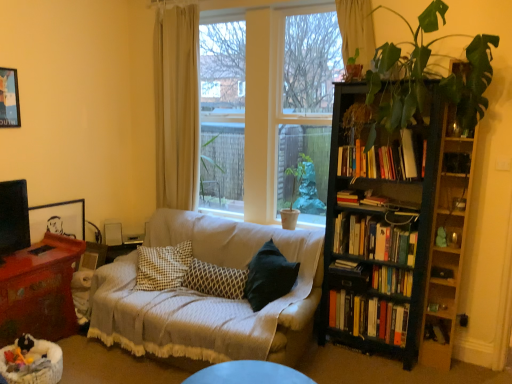
Find the location of a particular element. hardcover book at center-right, which is the 4th book from top to bottom is located at coordinates (x=346, y=267).

Describe the element at coordinates (346, 267) in the screenshot. I see `hardcover book at center-right, the third book ordered from the bottom` at that location.

In the scene shown: What is the approximate width of hardcover books at center-right, placed as the 6th book when sorted from bottom to top?

hardcover books at center-right, placed as the 6th book when sorted from bottom to top, is 10.52 inches in width.

What do you see at coordinates (384, 159) in the screenshot? This screenshot has width=512, height=384. I see `hardcover books at center-right, placed as the 6th book when sorted from bottom to top` at bounding box center [384, 159].

Where is `green leafy plant at upper right`? green leafy plant at upper right is located at coordinates (421, 71).

This screenshot has height=384, width=512. What are the coordinates of `black wooden bookcase at right` in the screenshot? It's located at (397, 240).

The image size is (512, 384). What do you see at coordinates (93, 256) in the screenshot?
I see `wooden picture frame at left, acting as the 1th picture frame starting from the back` at bounding box center [93, 256].

The width and height of the screenshot is (512, 384). Identify the location of hardcover books at right, which is the sixth book from top to bottom. (368, 317).

This screenshot has height=384, width=512. I want to click on hardcover book at center-right, the third book ordered from the bottom, so coord(346,267).

Considering the relative sizes of wooden picture frame at left, which appears as the second picture frame when viewed from the front, and patterned fabric pillow at center in the image provided, is wooden picture frame at left, which appears as the second picture frame when viewed from the front, thinner than patterned fabric pillow at center?

Yes, wooden picture frame at left, which appears as the second picture frame when viewed from the front, is thinner than patterned fabric pillow at center.

Relative to patterned fabric pillow at center, is wooden picture frame at left, arranged as the second picture frame when viewed from the top, in front or behind?

Visually, wooden picture frame at left, arranged as the second picture frame when viewed from the top, is located behind patterned fabric pillow at center.

From the image's perspective, which picture frame is the 1st one above the patterned fabric pillow at center? Please provide its 2D coordinates.

[(93, 256)]

Does wooden picture frame at left, which appears as the second picture frame when viewed from the front, appear on the right side of patterned fabric pillow at center?

Incorrect, wooden picture frame at left, which appears as the second picture frame when viewed from the front, is not on the right side of patterned fabric pillow at center.

Based on the photo, does mahogany wood table at lower left touch hardcover book at center-right, which is the 4th book from top to bottom?

They are not placed beside each other.

Based on the photo, which is correct: mahogany wood table at lower left is inside hardcover book at center-right, which is the 4th book from top to bottom, or outside of it?

mahogany wood table at lower left is not inside hardcover book at center-right, which is the 4th book from top to bottom, it's outside.

In the scene shown: From the image's perspective, who appears lower, mahogany wood table at lower left or hardcover book at center-right, the third book ordered from the bottom?

mahogany wood table at lower left appears lower in the image.

Between mahogany wood table at lower left and hardcover book at center-right, the third book ordered from the bottom, which one has larger width?

With larger width is mahogany wood table at lower left.

Considering the sizes of objects beige fabric curtain at upper center, which is counted as the first curtain, starting from the front, and mahogany wood table at lower left in the image provided, who is bigger, beige fabric curtain at upper center, which is counted as the first curtain, starting from the front, or mahogany wood table at lower left?

With larger size is mahogany wood table at lower left.

From the image's perspective, relative to mahogany wood table at lower left, is beige fabric curtain at upper center, the second curtain in the back-to-front sequence, above or below?

Clearly, from the image's perspective, beige fabric curtain at upper center, the second curtain in the back-to-front sequence, is above mahogany wood table at lower left.

Is beige fabric curtain at upper center, which is counted as the first curtain, starting from the front, turned away from mahogany wood table at lower left?

No, mahogany wood table at lower left is not at the back of beige fabric curtain at upper center, which is counted as the first curtain, starting from the front.

Locate an element on the screen. The height and width of the screenshot is (384, 512). picture frame that is the 2nd one above the mahogany wood table at lower left (from a real-world perspective) is located at coordinates point(9,98).

Is brushed metal picture frame at upper left, positioned as the second picture frame in right-to-left order, oriented towards mahogany wood table at lower left?

No, brushed metal picture frame at upper left, positioned as the second picture frame in right-to-left order, is not aimed at mahogany wood table at lower left.

Considering the sizes of objects brushed metal picture frame at upper left, positioned as the second picture frame in right-to-left order, and mahogany wood table at lower left in the image provided, who is shorter, brushed metal picture frame at upper left, positioned as the second picture frame in right-to-left order, or mahogany wood table at lower left?

Standing shorter between the two is brushed metal picture frame at upper left, positioned as the second picture frame in right-to-left order.

Does beige fabric curtain at upper left, which is counted as the 2th curtain, starting from the front, contain hardcover books at right, placed as the 3th book when sorted from top to bottom?

No, hardcover books at right, placed as the 3th book when sorted from top to bottom, is not surrounded by beige fabric curtain at upper left, which is counted as the 2th curtain, starting from the front.

From the image's perspective, which object appears higher, beige fabric curtain at upper left, which is counted as the 2th curtain, starting from the front, or hardcover books at right, arranged as the 4th book when ordered from the bottom?

beige fabric curtain at upper left, which is counted as the 2th curtain, starting from the front, from the image's perspective.

Is beige fabric curtain at upper left, the first curtain viewed from the left, to the left or to the right of hardcover books at right, arranged as the 4th book when ordered from the bottom, in the image?

Clearly, beige fabric curtain at upper left, the first curtain viewed from the left, is on the left of hardcover books at right, arranged as the 4th book when ordered from the bottom, in the image.

In the scene shown: Considering the sizes of objects hardcover book at center, the second book positioned from the top, and hardcover books at right, placed as the 3th book when sorted from top to bottom, in the image provided, who is bigger, hardcover book at center, the second book positioned from the top, or hardcover books at right, placed as the 3th book when sorted from top to bottom,?

Bigger between the two is hardcover books at right, placed as the 3th book when sorted from top to bottom.

Considering the sizes of objects hardcover book at center, which is the 5th book from bottom to top, and hardcover books at right, placed as the 3th book when sorted from top to bottom, in the image provided, who is wider, hardcover book at center, which is the 5th book from bottom to top, or hardcover books at right, placed as the 3th book when sorted from top to bottom,?

hardcover book at center, which is the 5th book from bottom to top, is wider.

Is hardcover book at center, which is the 5th book from bottom to top, turned away from hardcover books at right, arranged as the 4th book when ordered from the bottom?

No, hardcover books at right, arranged as the 4th book when ordered from the bottom, is not at the back of hardcover book at center, which is the 5th book from bottom to top.

Can you tell me how much beige fabric curtain at upper center, which is counted as the first curtain, starting from the front, and green leafy plant at upper right differ in facing direction?

There is a 0.219-degree angle between the facing directions of beige fabric curtain at upper center, which is counted as the first curtain, starting from the front, and green leafy plant at upper right.

Consider the image. Looking at the image, does beige fabric curtain at upper center, placed as the 1th curtain when sorted from right to left, seem bigger or smaller compared to green leafy plant at upper right?

Clearly, beige fabric curtain at upper center, placed as the 1th curtain when sorted from right to left, is smaller in size than green leafy plant at upper right.

Is beige fabric curtain at upper center, the second curtain in the back-to-front sequence, aimed at green leafy plant at upper right?

No, beige fabric curtain at upper center, the second curtain in the back-to-front sequence, is not oriented towards green leafy plant at upper right.

Considering the positions of objects beige fabric curtain at upper center, placed as the 1th curtain when sorted from right to left, and green leafy plant at upper right in the image provided, who is more to the right, beige fabric curtain at upper center, placed as the 1th curtain when sorted from right to left, or green leafy plant at upper right?

Positioned to the right is green leafy plant at upper right.

This screenshot has height=384, width=512. I want to click on pillow below the wooden picture frame at left, which appears as the second picture frame when viewed from the front (from the image's perspective), so click(x=215, y=280).

Starting from the mahogany wood table at lower left, which book is the 5th one behind? Please provide its 2D coordinates.

[(346, 267)]

Which object lies further to the anchor point wooden picture frame at left, which appears as the second picture frame when viewed from the front, brushed metal picture frame at upper left, positioned as the second picture frame in right-to-left order, or clear glass window at center?

clear glass window at center lies further to wooden picture frame at left, which appears as the second picture frame when viewed from the front, than the other object.

Which object lies nearer to the anchor point hardcover books at right, arranged as the 4th book when ordered from the bottom, patterned fabric pillow at center or wooden picture frame at left, the first picture frame viewed from the right?

The object closer to hardcover books at right, arranged as the 4th book when ordered from the bottom, is patterned fabric pillow at center.

Based on their spatial positions, is mahogany wood table at lower left or black wooden bookcase at right closer to patterned fabric pillow at center?

Based on the image, mahogany wood table at lower left appears to be nearer to patterned fabric pillow at center.

Which object lies nearer to the anchor point wooden picture frame at left, acting as the 1th picture frame starting from the back, hardcover books at right, which ranks as the 5th book in top-to-bottom order, or hardcover book at center-right, the third book ordered from the bottom?

The object closer to wooden picture frame at left, acting as the 1th picture frame starting from the back, is hardcover book at center-right, the third book ordered from the bottom.

Looking at the image, which one is located further to hardcover book at center, the second book positioned from the top, hardcover books at center-right, placed as the first book when sorted from top to bottom, or green matte plant at center?

Based on the image, green matte plant at center appears to be further to hardcover book at center, the second book positioned from the top.

Based on their spatial positions, is green matte plant at center or green leafy plant at upper right further from patterned fabric pillow at center?

Based on the image, green leafy plant at upper right appears to be further to patterned fabric pillow at center.

Considering their positions, is hardcover book at center-right, the third book ordered from the bottom, positioned further to hardcover books at right, arranged as the 4th book when ordered from the bottom, than beige fabric curtain at upper center, which is counted as the first curtain, starting from the front?

beige fabric curtain at upper center, which is counted as the first curtain, starting from the front, is further to hardcover books at right, arranged as the 4th book when ordered from the bottom.

When comparing their distances from wooden picture frame at left, which appears as the second picture frame when viewed from the front, does hardcover book at center-right, the third book ordered from the bottom, or patterned fabric pillow at center seem closer?

Based on the image, patterned fabric pillow at center appears to be nearer to wooden picture frame at left, which appears as the second picture frame when viewed from the front.

I want to click on curtain between mahogany wood table at lower left and hardcover book at center-right, the third book ordered from the bottom, so click(176, 105).

At what (x,y) coordinates should I click in order to perform the action: click on picture frame located between mahogany wood table at lower left and patterned fabric pillow at center in the left-right direction. Please return your answer as a coordinate pair (x, y). Looking at the image, I should click on (93, 256).

Locate an element on the screen. This screenshot has width=512, height=384. bookcase situated between wooden picture frame at left, acting as the 1th picture frame starting from the back, and green leafy plant at upper right from left to right is located at coordinates (397, 240).

Where is `window between brushed metal picture frame at upper left, positioned as the second picture frame in right-to-left order, and hardcover books at right, placed as the 3th book when sorted from top to bottom, in the horizontal direction`? This screenshot has width=512, height=384. window between brushed metal picture frame at upper left, positioned as the second picture frame in right-to-left order, and hardcover books at right, placed as the 3th book when sorted from top to bottom, in the horizontal direction is located at coordinates (284, 101).